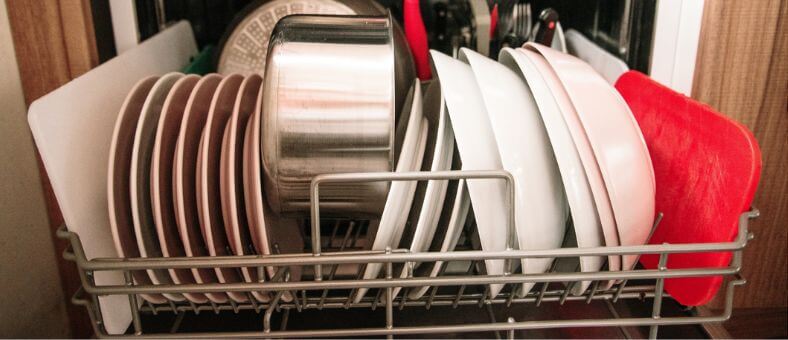
The width and height of the screenshot is (788, 340). In order to click on plates in dishwasher in this screenshot , I will do `click(110, 137)`, `click(132, 147)`, `click(162, 154)`, `click(179, 181)`, `click(209, 168)`, `click(228, 173)`, `click(255, 191)`, `click(409, 150)`, `click(433, 163)`, `click(458, 229)`.